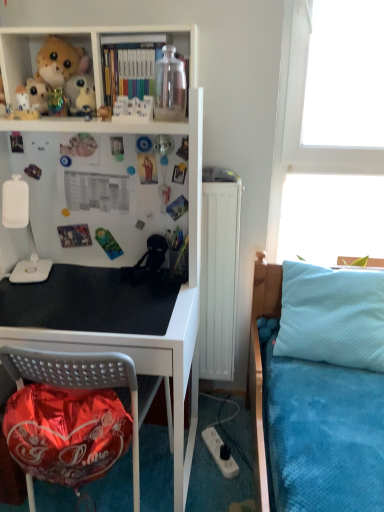
Question: Is white plastic lamp at left inside or outside of light blue quilted pillow at right?

Choices:
 (A) outside
 (B) inside

Answer: (A)

Question: Considering the positions of point (11, 279) and point (291, 313), is point (11, 279) closer or farther from the camera than point (291, 313)?

Choices:
 (A) farther
 (B) closer

Answer: (B)

Question: Considering the real-world distances, which object is closest to the white plastic lamp at left?

Choices:
 (A) matte plastic books at upper center
 (B) white matte plush toy at upper left, which is counted as the second toy, starting from the right
 (C) light blue quilted pillow at right
 (D) white plastic power outlet at lower center
 (E) metallic black desk at lower left

Answer: (E)

Question: Estimate the real-world distances between objects in this image. Which object is closer to the white plastic lamp at left?

Choices:
 (A) metallic black desk at lower left
 (B) white plush toy at upper left, which ranks as the third toy in front-to-back order
 (C) white plastic power outlet at lower center
 (D) white matte plush toy at upper left, which is counted as the 2th toy, starting from the left
 (E) black matte desk at center

Answer: (E)